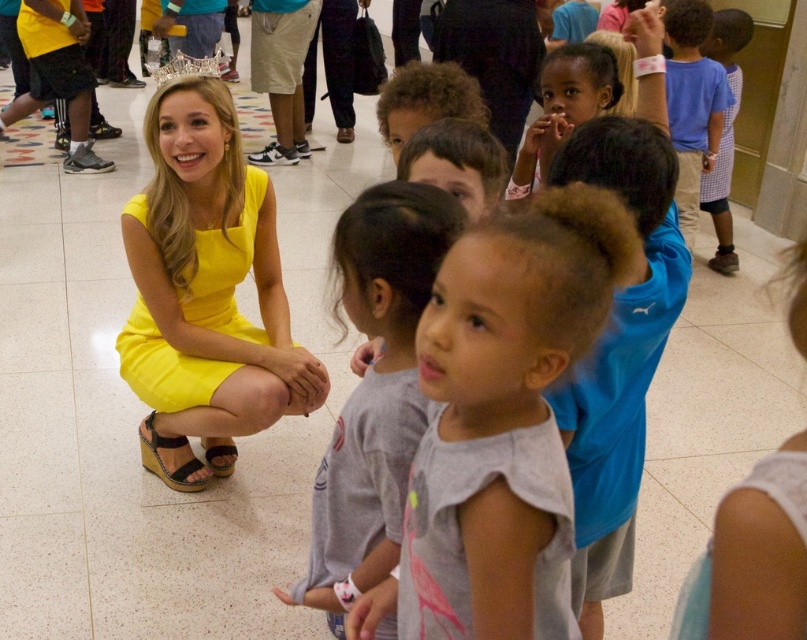
Which is above, yellow matte dress at center or clear crystal crown at upper center?

clear crystal crown at upper center

You are a GUI agent. You are given a task and a screenshot of the screen. Output one action in this format:
    pyautogui.click(x=<x>, y=<y>)
    Task: Click on the yellow matte dress at center
    The height and width of the screenshot is (640, 807).
    Given the screenshot: What is the action you would take?
    coord(224,268)

Locate an element on the screen. This screenshot has height=640, width=807. yellow matte dress at center is located at coordinates (224, 268).

Who is positioned more to the left, yellow satin dress at center or clear crystal crown at upper center?

Positioned to the left is clear crystal crown at upper center.

Which is below, yellow satin dress at center or clear crystal crown at upper center?

Positioned lower is yellow satin dress at center.

Who is more distant from viewer, (123, 378) or (215, 58)?

Positioned behind is point (215, 58).

Locate an element on the screen. yellow satin dress at center is located at coordinates (205, 292).

Between yellow satin dress at center and gray cotton shirt at center, which one is positioned lower?

gray cotton shirt at center

Does yellow satin dress at center have a smaller size compared to gray cotton shirt at center?

Incorrect, yellow satin dress at center is not smaller in size than gray cotton shirt at center.

Is point (170, 92) closer to camera compared to point (412, 244)?

No, (170, 92) is further to viewer.

This screenshot has height=640, width=807. In order to click on yellow satin dress at center in this screenshot , I will do `click(205, 292)`.